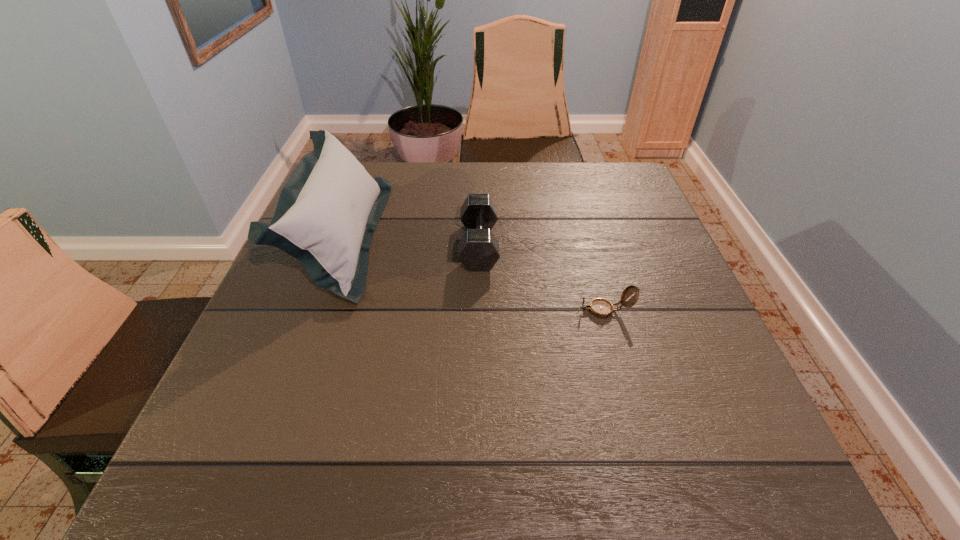
This screenshot has height=540, width=960. Identify the location of cushion. (327, 212).

Where is `the tallest object`? the tallest object is located at coordinates (327, 212).

Find the location of a particular element. Image resolution: width=960 pixels, height=540 pixels. the second shortest object is located at coordinates (478, 250).

What are the coordinates of `the second object from left to right` in the screenshot? It's located at (478, 250).

The image size is (960, 540). I want to click on the rightmost object, so click(x=601, y=308).

The height and width of the screenshot is (540, 960). Find the location of `the shortest object`. the shortest object is located at coordinates (x=601, y=308).

You are a GUI agent. You are given a task and a screenshot of the screen. Output one action in this format:
    pyautogui.click(x=<x>, y=<y>)
    Task: Click on the vacant region located 0.080m on the surface of the tallest object
    
    Given the screenshot: What is the action you would take?
    tap(413, 237)

Find the location of a particular element. This screenshot has height=540, width=960. vacant space located 0.140m on the right of the dumbbell is located at coordinates (558, 245).

Identify the location of free space located on the face of the compass. The image size is (960, 540). (408, 310).

Identify the location of vacant space located on the face of the compass. (483, 310).